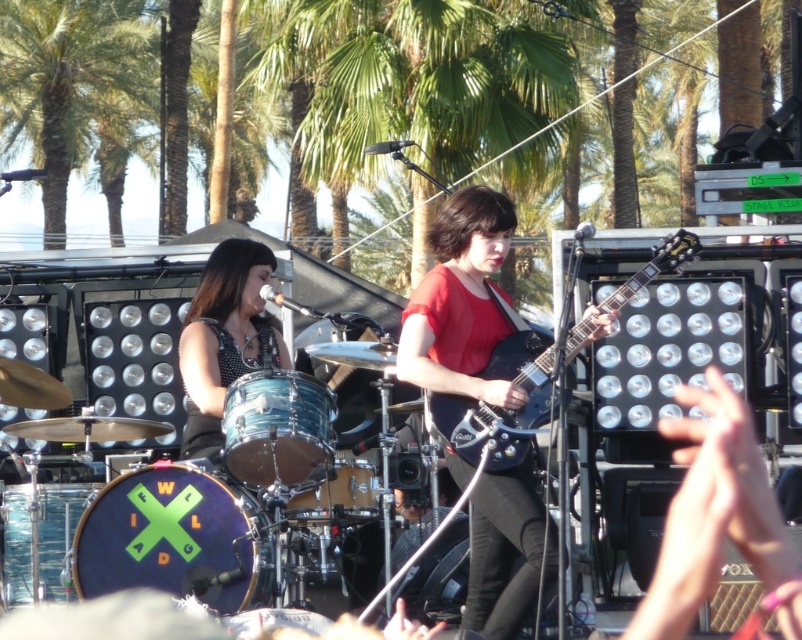
Can you confirm if blue drumhead at center is wider than shiny black drum at left?

Indeed, blue drumhead at center has a greater width compared to shiny black drum at left.

Which is behind, point (80, 531) or point (268, 324)?

Positioned behind is point (268, 324).

Between point (88, 592) and point (244, 282), which one is positioned in front?

Point (88, 592) is in front.

Identify the location of blue drumhead at center. (172, 538).

Consider the image. Can you confirm if shiny black drum at left is smaller than brushed metal drum at lower left?

Incorrect, shiny black drum at left is not smaller in size than brushed metal drum at lower left.

Can you confirm if shiny black drum at left is thinner than brushed metal drum at lower left?

No, shiny black drum at left is not thinner than brushed metal drum at lower left.

What do you see at coordinates (225, 339) in the screenshot? I see `shiny black drum at left` at bounding box center [225, 339].

You are a GUI agent. You are given a task and a screenshot of the screen. Output one action in this format:
    pyautogui.click(x=<x>, y=<y>)
    Task: Click on the shiny black drum at left
    This screenshot has width=802, height=640.
    Given the screenshot: What is the action you would take?
    [x=225, y=339]

Is matte black guitar at center below brushed metal drum at lower left?

Yes, matte black guitar at center is below brushed metal drum at lower left.

Between matte black guitar at center and brushed metal drum at lower left, which one is positioned higher?

brushed metal drum at lower left is higher up.

Is point (460, 216) behind point (55, 515)?

Yes, point (460, 216) is farther from viewer.

Where is `matte black guitar at center`? matte black guitar at center is located at coordinates (460, 301).